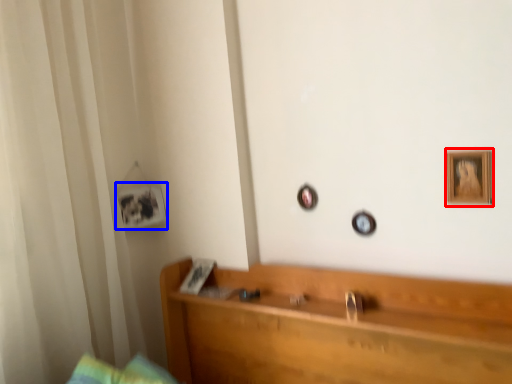
Question: Which object appears closest to the camera in this image, picture frame (highlighted by a red box) or picture frame (highlighted by a blue box)?

Choices:
 (A) picture frame
 (B) picture frame

Answer: (A)